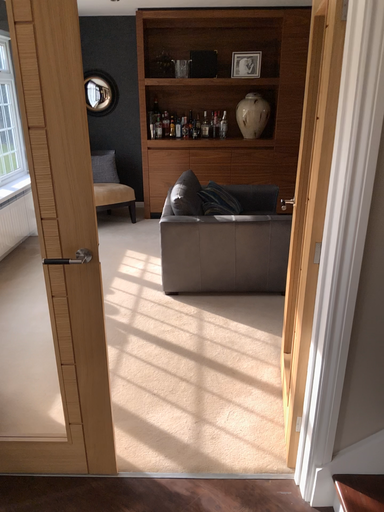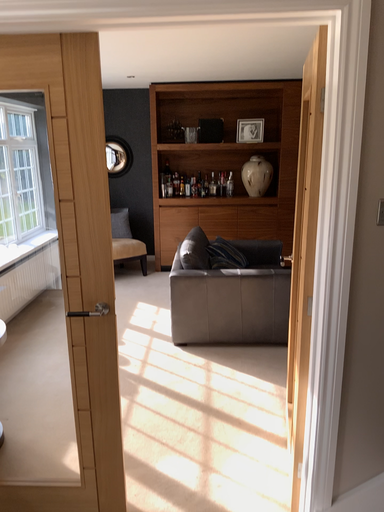
Question: How did the camera likely rotate when shooting the video?

Choices:
 (A) rotated downward
 (B) rotated upward

Answer: (B)